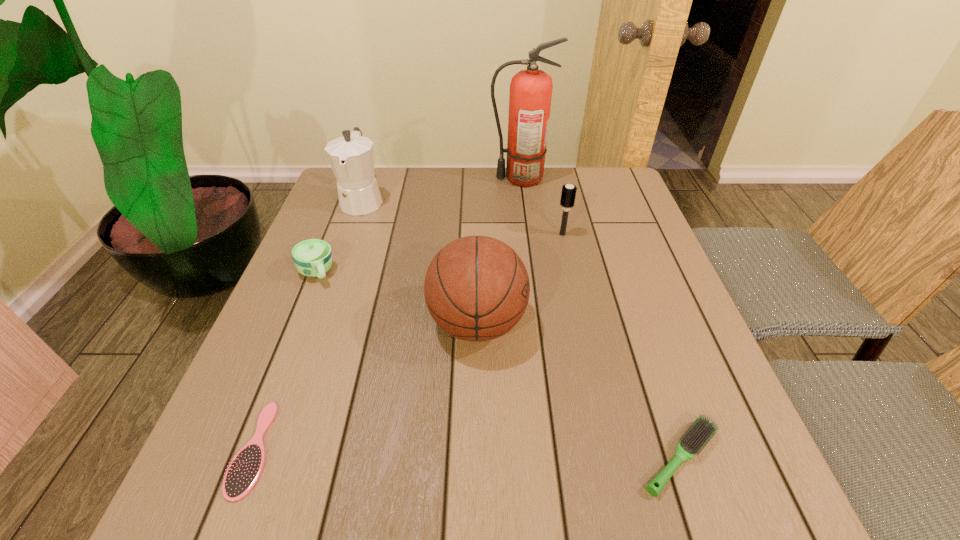
The width and height of the screenshot is (960, 540). I want to click on the tallest object, so click(530, 96).

This screenshot has width=960, height=540. I want to click on coffeepot, so click(x=351, y=157).

The image size is (960, 540). What are the coordinates of `the third nearest object` in the screenshot? It's located at (476, 288).

The image size is (960, 540). Identify the location of the fourth shortest object. (568, 193).

I want to click on the second hairbrush from right to left, so click(568, 193).

The image size is (960, 540). In order to click on cup in this screenshot , I will do `click(313, 258)`.

Find the location of a particular element. the third shortest object is located at coordinates (313, 258).

This screenshot has height=540, width=960. Find the location of `the rightmost object`. the rightmost object is located at coordinates (702, 430).

This screenshot has height=540, width=960. I want to click on the rightmost hairbrush, so (702, 430).

At what (x,y) coordinates should I click in order to perform the action: click on the shortest hairbrush. Please return your answer as a coordinate pair (x, y). The height and width of the screenshot is (540, 960). Looking at the image, I should click on (245, 469).